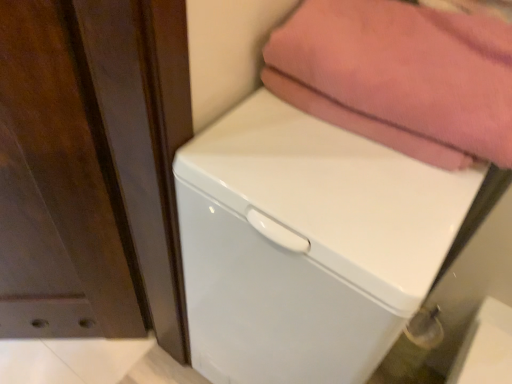
Where is `empty space that is ontop of white glossy dishwasher at center`? The height and width of the screenshot is (384, 512). empty space that is ontop of white glossy dishwasher at center is located at coordinates (344, 169).